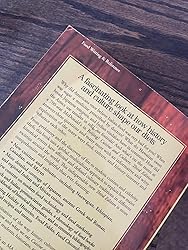
You are a GUI agent. You are given a task and a screenshot of the screen. Output one action in this format:
    pyautogui.click(x=<x>, y=<y>)
    Task: Click on the table
    
    Given the screenshot: What is the action you would take?
    pyautogui.click(x=18, y=35), pyautogui.click(x=126, y=28), pyautogui.click(x=182, y=226)